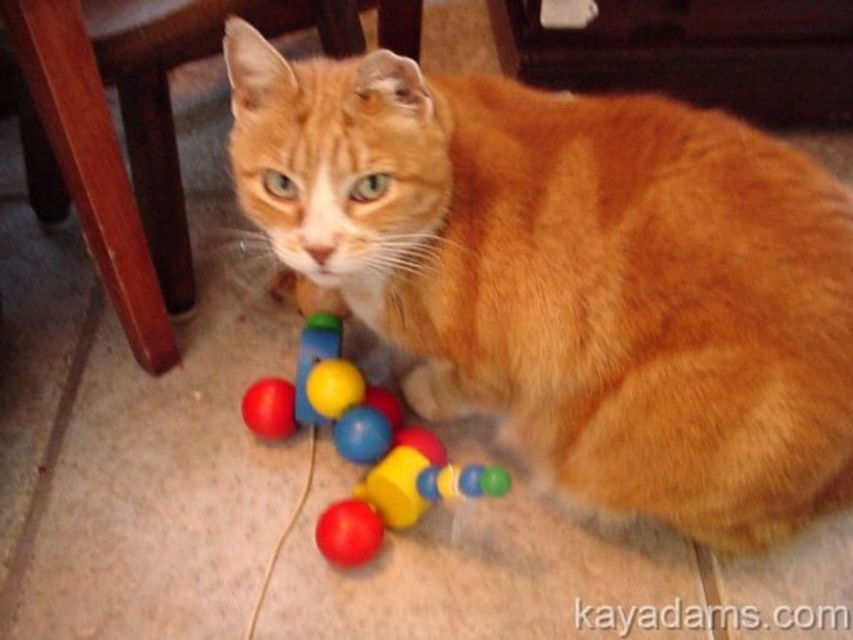
Consider the image. Between wooden chair at lower left and smooth plastic toy at lower center, which one has less height?

Standing shorter between the two is smooth plastic toy at lower center.

Does wooden chair at lower left appear under smooth plastic toy at lower center?

Actually, wooden chair at lower left is above smooth plastic toy at lower center.

I want to click on wooden chair at lower left, so click(128, 134).

Between smooth plastic toy at lower center and rubber string at lower center, which one has less height?

rubber string at lower center

Is smooth plastic toy at lower center shorter than rubber string at lower center?

Incorrect, smooth plastic toy at lower center's height does not fall short of rubber string at lower center's.

Where is `smooth plastic toy at lower center`? smooth plastic toy at lower center is located at coordinates (361, 445).

How far apart are orange fur cat at center and rubber string at lower center?

A distance of 21.53 inches exists between orange fur cat at center and rubber string at lower center.

Can you confirm if orange fur cat at center is wider than rubber string at lower center?

Correct, the width of orange fur cat at center exceeds that of rubber string at lower center.

Which is behind, point (654, 387) or point (312, 426)?

Positioned behind is point (312, 426).

This screenshot has height=640, width=853. What are the coordinates of `orange fur cat at center` in the screenshot? It's located at click(x=572, y=275).